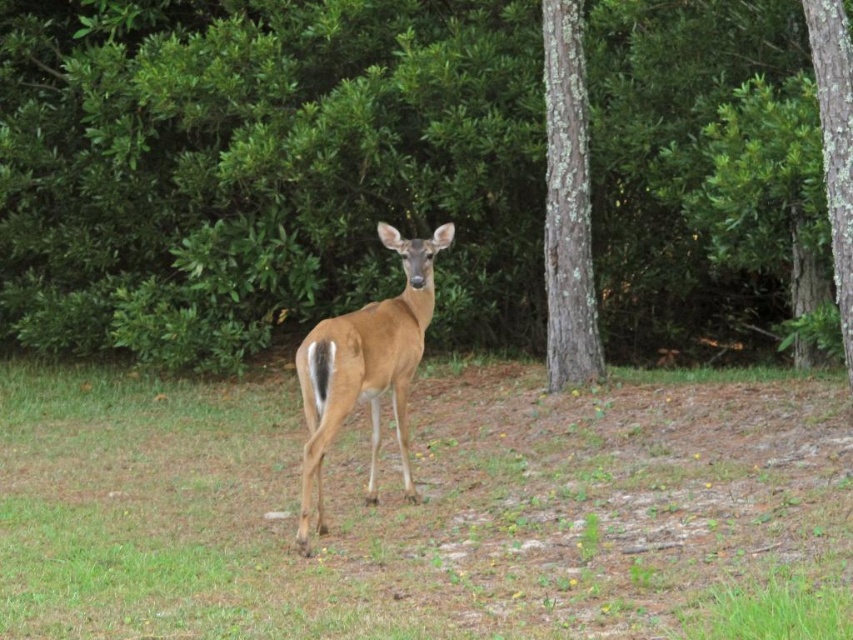
Question: Is brown matte/deer at center to the left of smooth bark tree at center from the viewer's perspective?

Choices:
 (A) no
 (B) yes

Answer: (B)

Question: Can you confirm if brown matte/deer at center is positioned to the right of smooth bark tree at right?

Choices:
 (A) no
 (B) yes

Answer: (A)

Question: Among these points, which one is farthest from the camera?

Choices:
 (A) (407, 330)
 (B) (584, 243)

Answer: (B)

Question: Estimate the real-world distances between objects in this image. Which object is farther from the green grass at center?

Choices:
 (A) brown matte/deer at center
 (B) smooth bark tree at center

Answer: (B)

Question: Considering the relative positions of smooth bark tree at center and smooth bark tree at right in the image provided, where is smooth bark tree at center located with respect to smooth bark tree at right?

Choices:
 (A) below
 (B) above

Answer: (B)

Question: Which point is farther to the camera?

Choices:
 (A) smooth bark tree at right
 (B) green grass at center

Answer: (A)